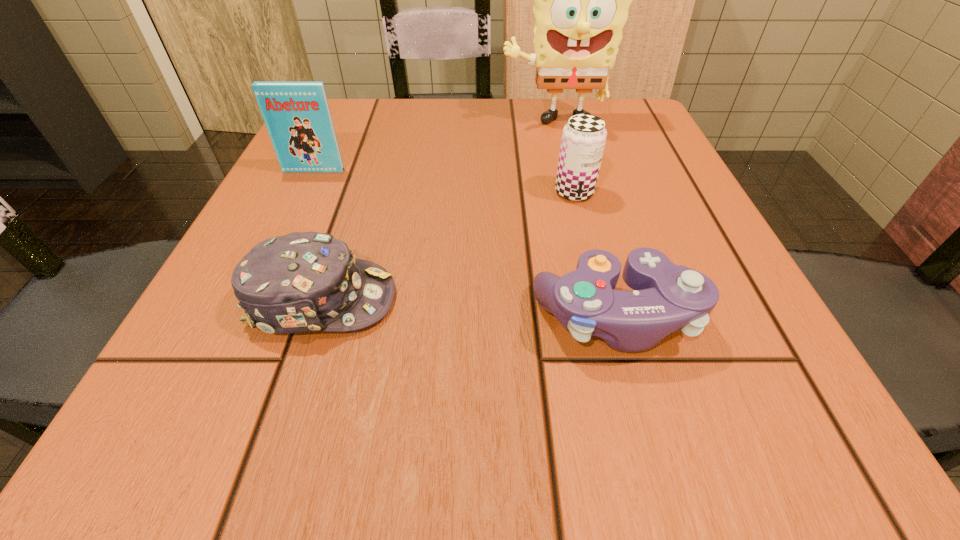
This screenshot has height=540, width=960. In the image, there is a desktop. Identify the location of vacant space at the near edge. (412, 419).

Where is `blank area at the left edge`? Image resolution: width=960 pixels, height=540 pixels. blank area at the left edge is located at coordinates (211, 298).

Locate an element on the screen. free space at the right edge of the desktop is located at coordinates pyautogui.click(x=745, y=328).

Where is `vacant point at the far right corner`? The image size is (960, 540). vacant point at the far right corner is located at coordinates (609, 136).

In the image, there is a desktop. Where is `blank space at the near right corner`? This screenshot has height=540, width=960. blank space at the near right corner is located at coordinates tap(809, 428).

The width and height of the screenshot is (960, 540). Find the location of `vacant space in between the sponge and the control`. vacant space in between the sponge and the control is located at coordinates [x=585, y=220].

Where is `vacant space that's between the fourth nearest object and the control`? This screenshot has width=960, height=540. vacant space that's between the fourth nearest object and the control is located at coordinates (465, 244).

You are a GUI agent. You are given a task and a screenshot of the screen. Output one action in this format:
    pyautogui.click(x=<x>, y=<y>)
    Task: Click on the free space between the control and the headwear
    The image size is (960, 540).
    Given the screenshot: What is the action you would take?
    pyautogui.click(x=468, y=308)

Identify the location of free space that is in between the headwear and the beer can. This screenshot has width=960, height=540. (448, 246).

Identify the location of free space between the control and the second farthest object. This screenshot has height=540, width=960. (465, 244).